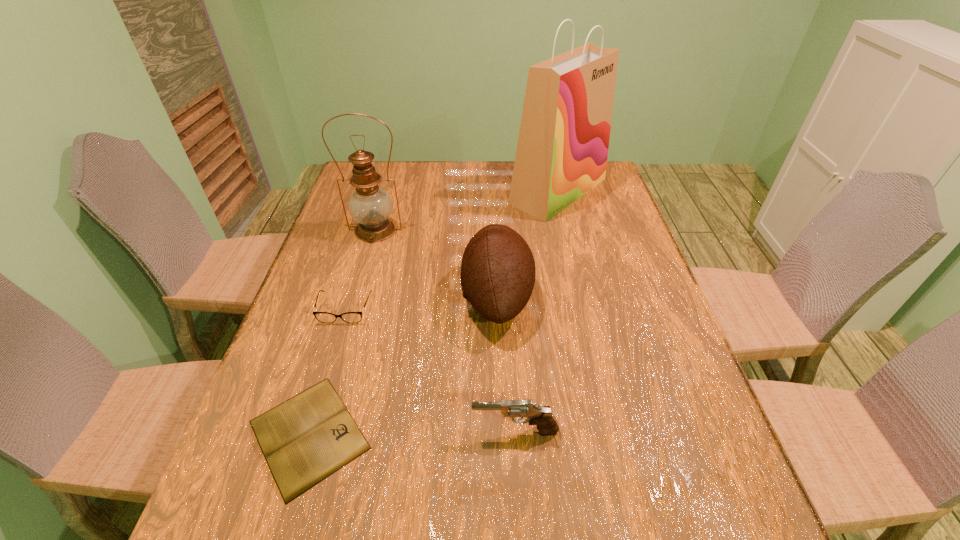
Where is `shopping bag`? shopping bag is located at coordinates (562, 149).

What are the coordinates of `the second tallest object` in the screenshot? It's located at (371, 206).

Image resolution: width=960 pixels, height=540 pixels. I want to click on football, so click(498, 271).

Identify the location of the third shortest object. (547, 425).

Where is `spectacles`? This screenshot has height=540, width=960. spectacles is located at coordinates (324, 317).

Where is `book`? book is located at coordinates (307, 438).

You are a GUI agent. You are given a task and a screenshot of the screen. Output one action in this format:
    pyautogui.click(x=<x>, y=<y>)
    Task: Click on the free space located on the left of the shopping bag
    Image resolution: width=960 pixels, height=540 pixels.
    Given the screenshot: What is the action you would take?
    pyautogui.click(x=396, y=191)

This screenshot has width=960, height=540. Identify the location of blank space located 0.150m on the right of the fifth shortest object. [454, 230].

The image size is (960, 540). I want to click on vacant space situated 0.280m on the laces of the third tallest object, so click(353, 297).

Locate an element on the screen. This screenshot has height=540, width=960. vacant space located 0.340m on the laces of the third tallest object is located at coordinates (330, 297).